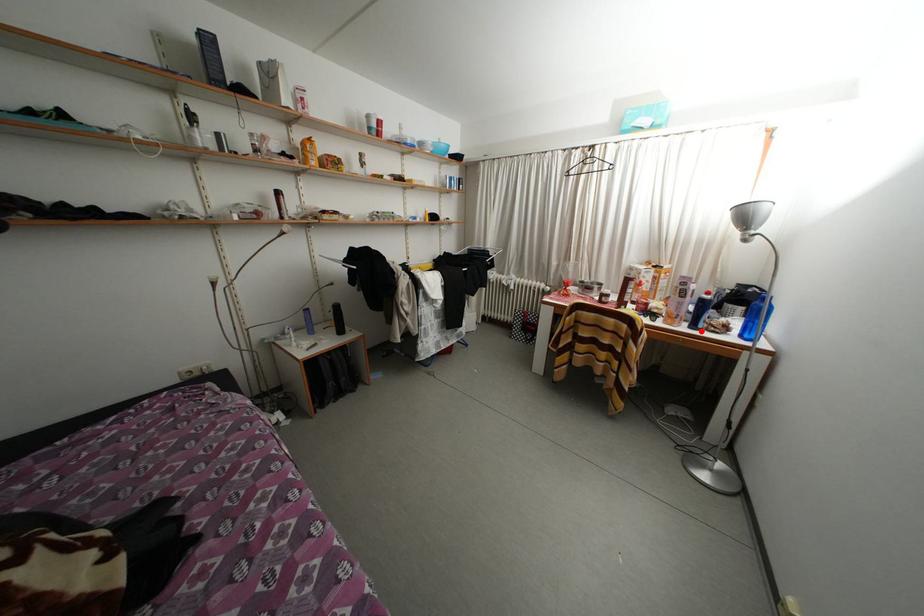
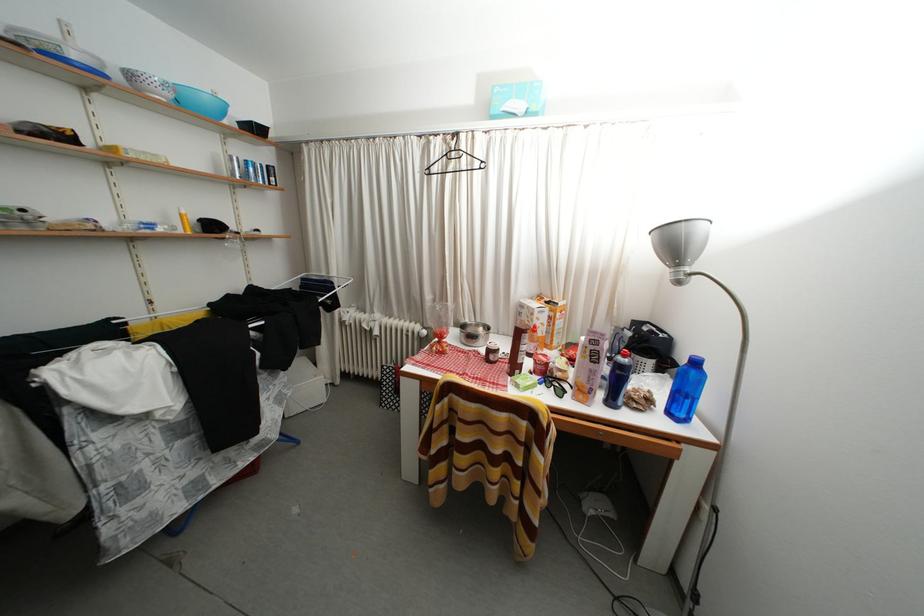
Where in the second image is the point corresponding to the highlighted location from the first image?

(618, 408)